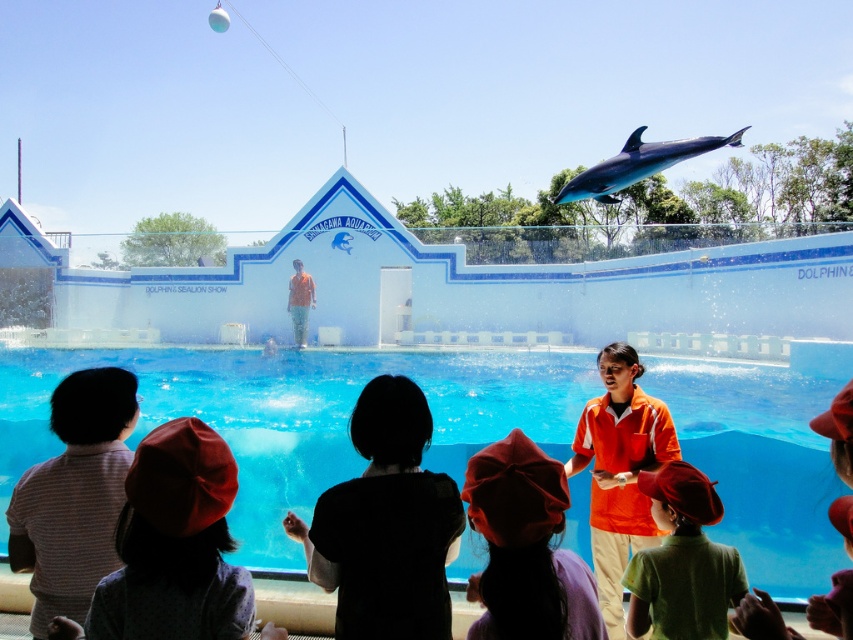
Question: Based on their relative distances, which object is nearer to the shiny blue dolphin at upper center?

Choices:
 (A) orange fabric trainer at center
 (B) red fabric hat at lower center
 (C) transparent glass pool at center
 (D) red fabric hat at lower left

Answer: (B)

Question: Which point is closer to the camera taking this photo?

Choices:
 (A) (624, 573)
 (B) (234, 611)
 (C) (563, 488)
 (D) (416, 364)

Answer: (C)

Question: Does transparent glass pool at center appear under green matte shirt at lower center?

Choices:
 (A) no
 (B) yes

Answer: (B)

Question: Which point is farther to the camera?

Choices:
 (A) (641, 477)
 (B) (589, 600)
 (C) (386, 467)

Answer: (A)

Question: Can you confirm if green matte shirt at lower center is positioned to the right of shiny blue dolphin at upper center?

Choices:
 (A) no
 (B) yes

Answer: (A)

Question: Is red fabric hat at lower center positioned before green matte shirt at lower center?

Choices:
 (A) yes
 (B) no

Answer: (A)